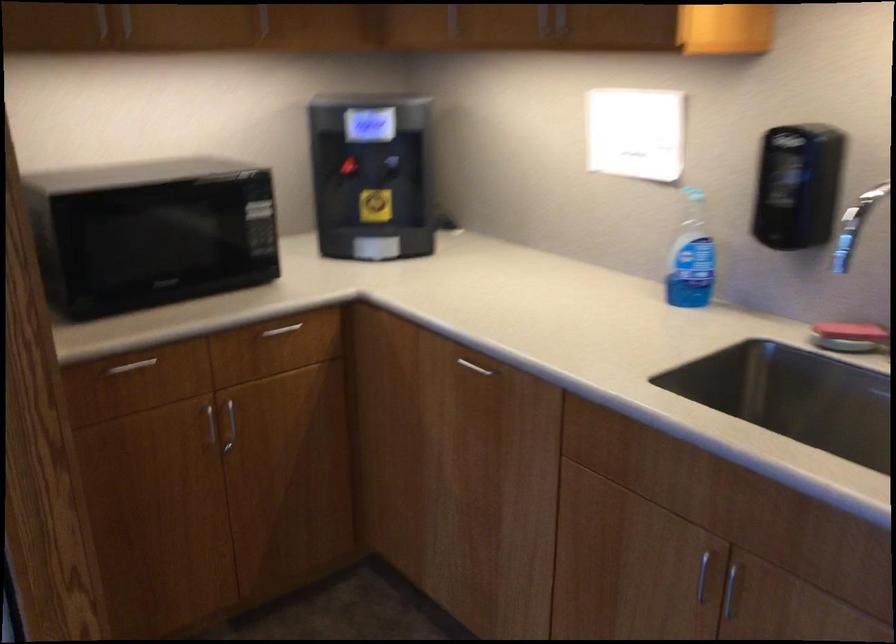
Locate an element on the screen. This screenshot has width=896, height=644. kitchen sponge is located at coordinates (848, 337).